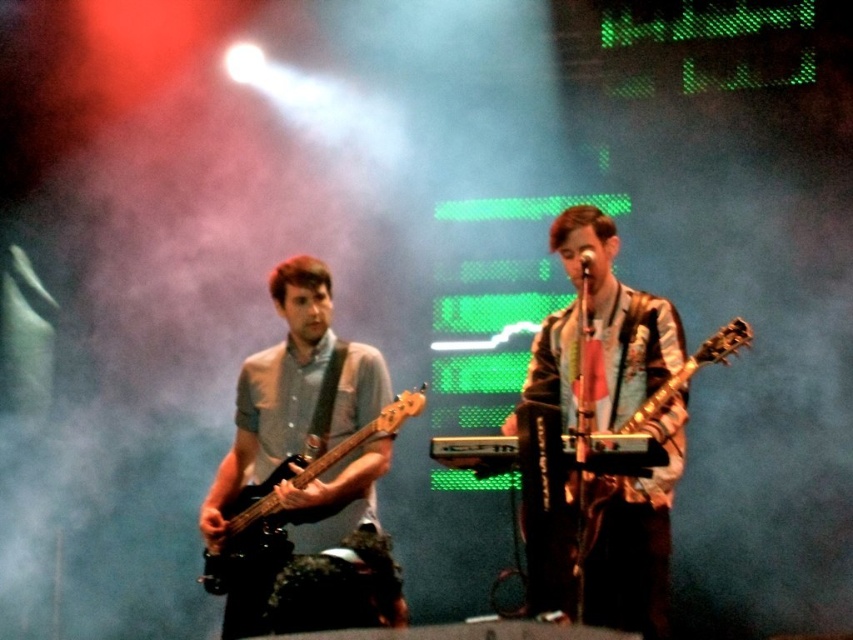
You are a photographer positioned at the front of the stage. You want to capture a close shot of the electric bass guitarist and the keyboardist. Given their positions at point coordinates point (630, 557) and point (407, 396) respectively, which musician should you focus on first to ensure they are in focus?

Point (630, 557) is closer to the camera than point (407, 396), so you should focus on the electric bass guitarist at point (630, 557) first to ensure they are in focus before the keyboardist.

You are a photographer positioned at the back of the concert venue. You want to capture a photo that includes both the shiny silver guitar at center and the matte black bass guitar at left. Based on their positions, which guitar should you focus on first to ensure both are in frame?

The shiny silver guitar at center is to the right of the matte black bass guitar at left. Since the matte black bass guitar at left is positioned to the left, you should focus on it first to ensure both guitars are included in the frame.